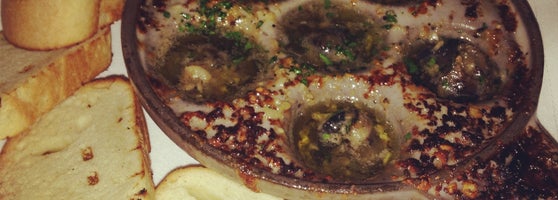
Identify the location of ceramic dish. (206, 156).